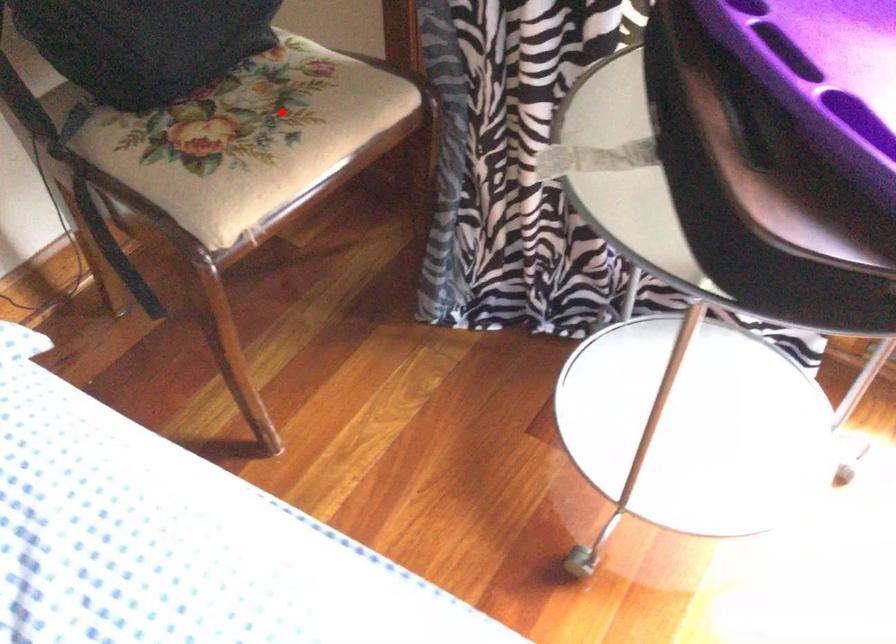
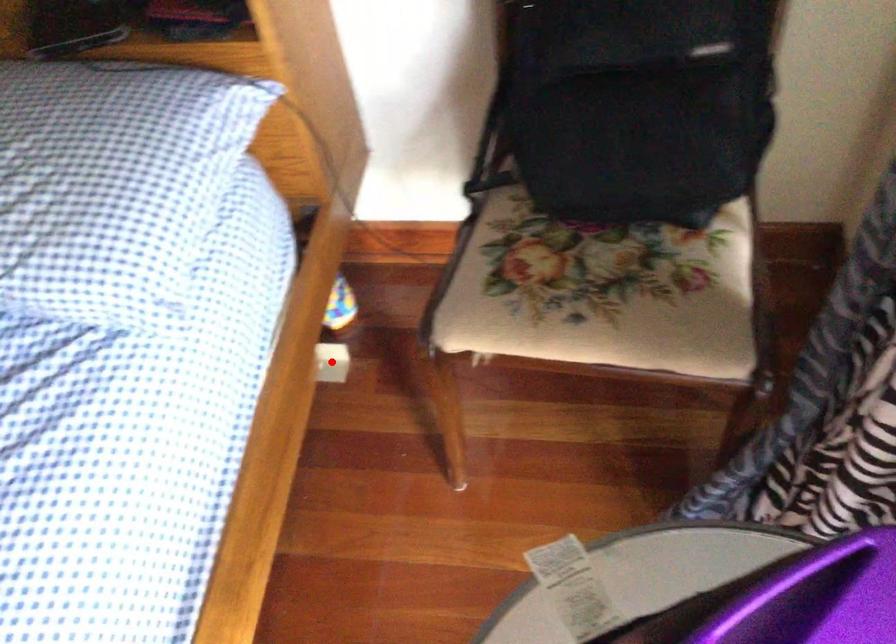
I am providing you with two images of the same scene from different viewpoints. A red point is marked on the first image and another point is marked on the second image. Are the points marked in image1 and image2 representing the same 3D position?

No